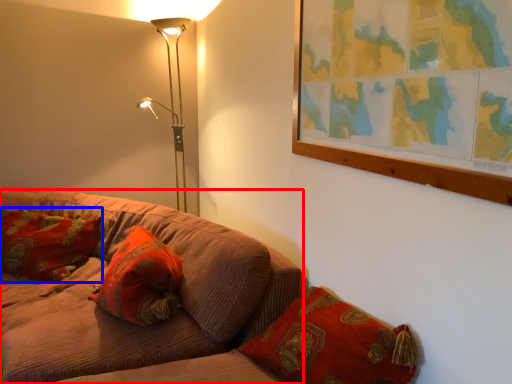
Question: Which of the following is the closest to the observer, studio couch (highlighted by a red box) or pillow (highlighted by a blue box)?

Choices:
 (A) studio couch
 (B) pillow

Answer: (A)